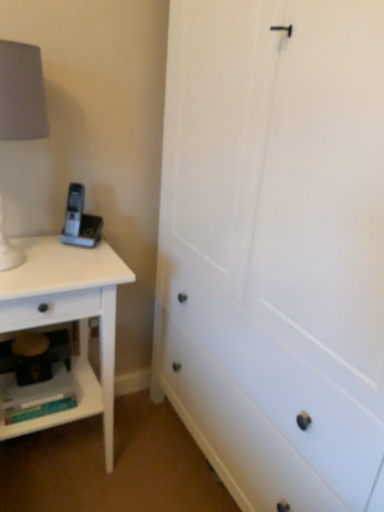
This screenshot has height=512, width=384. Identify the location of vacant area located to the right-hand side of white matte lampshade at left. (84, 264).